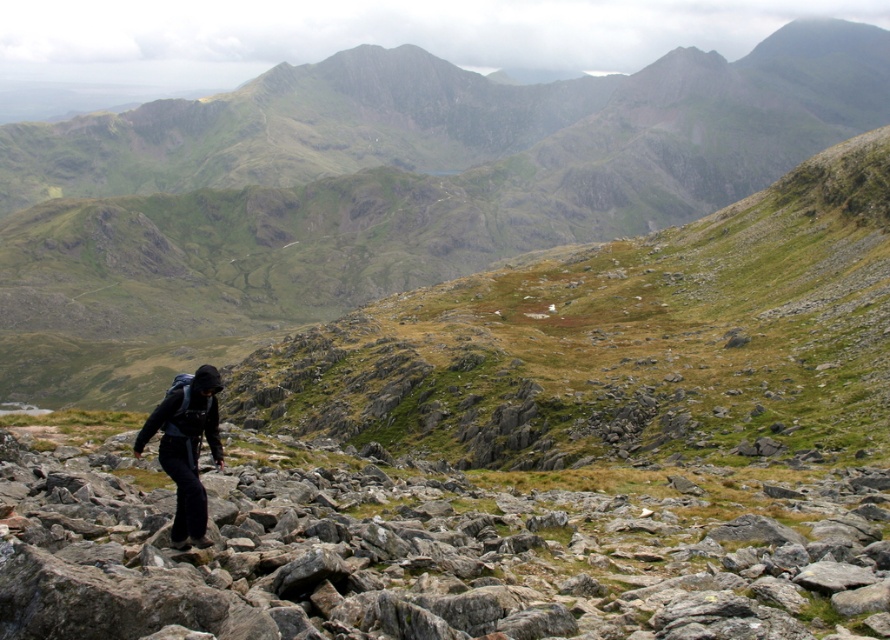
You are a hiker planning to cross the rocky terrain. You see the green grassy hillside at center and the gray rough rock at center. Which object is closer to you as you approach the scene from the front?

The green grassy hillside at center is closer to you because the gray rough rock at center is positioned behind it.

You are a hiker trying to navigate through the rocky terrain in the image. You need to reach the green grassy hillside at center. Which direction should you move from your current position at point (418, 209)?

The point (418, 209) is already on the green grassy hillside at center, so you are already there.